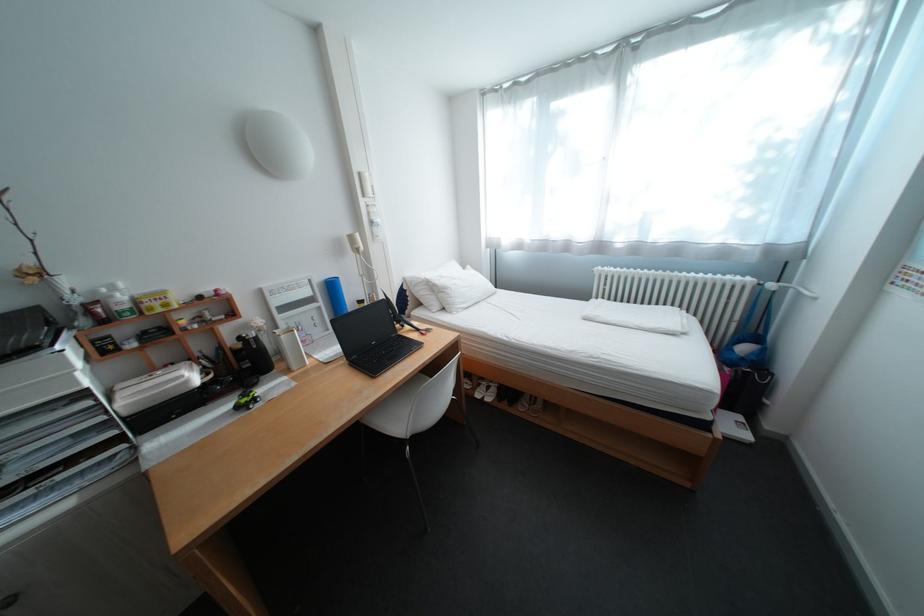
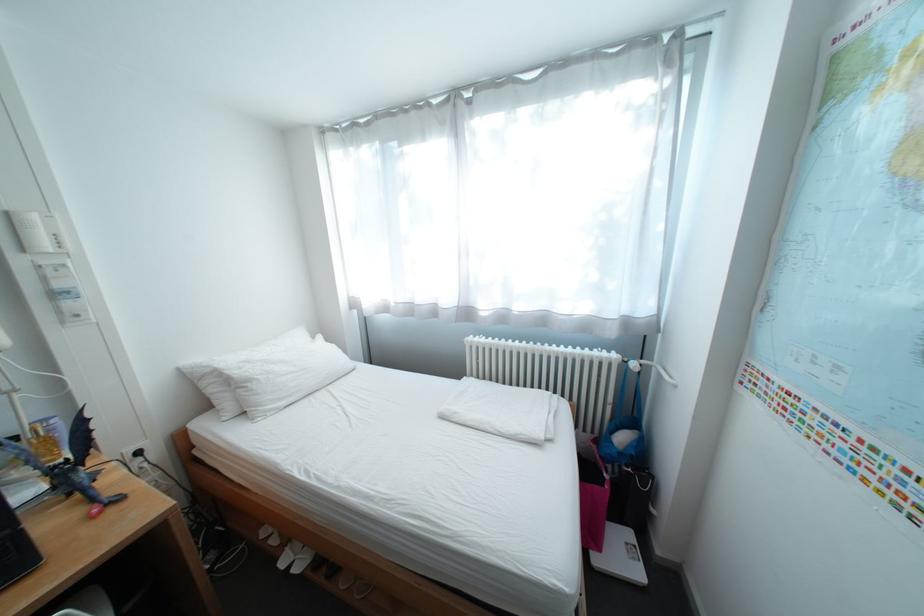
Where in the second image is the point corresponding to point 772,285 from the first image?

(637, 362)